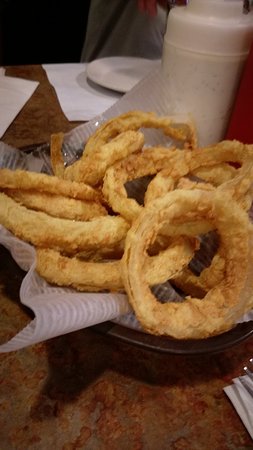
Image resolution: width=253 pixels, height=450 pixels. I want to click on placemat, so [77, 92].